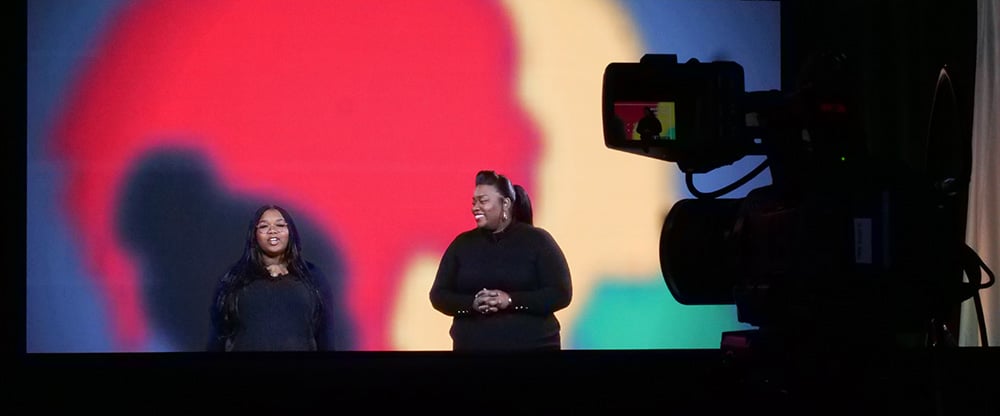
Find the location of a particular element. screen is located at coordinates (474, 92).